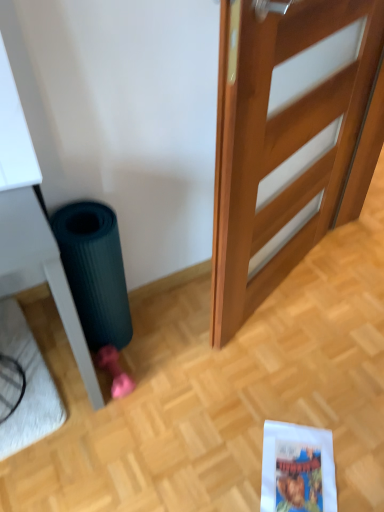
Question: Are wooden door at center and dark green rubber mat at lower left beside each other?

Choices:
 (A) no
 (B) yes

Answer: (A)

Question: Does wooden door at center appear on the right side of dark green rubber mat at lower left?

Choices:
 (A) yes
 (B) no

Answer: (A)

Question: From a real-world perspective, is wooden door at center physically below dark green rubber mat at lower left?

Choices:
 (A) no
 (B) yes

Answer: (A)

Question: From the image's perspective, would you say wooden door at center is positioned over dark green rubber mat at lower left?

Choices:
 (A) no
 (B) yes

Answer: (B)

Question: Does wooden door at center have a larger size compared to dark green rubber mat at lower left?

Choices:
 (A) no
 (B) yes

Answer: (B)

Question: Is white plush doormat at lower left spatially inside wooden door at center, or outside of it?

Choices:
 (A) outside
 (B) inside

Answer: (A)

Question: Looking at their shapes, would you say white plush doormat at lower left is wider or thinner than wooden door at center?

Choices:
 (A) wide
 (B) thin

Answer: (A)

Question: Based on their sizes in the image, would you say white plush doormat at lower left is bigger or smaller than wooden door at center?

Choices:
 (A) small
 (B) big

Answer: (A)

Question: Would you say white plush doormat at lower left is to the left or to the right of wooden door at center in the picture?

Choices:
 (A) right
 (B) left

Answer: (B)

Question: Is point (66, 273) closer or farther from the camera than point (44, 403)?

Choices:
 (A) closer
 (B) farther

Answer: (A)

Question: In the image, is dark green rubber mat at lower left positioned in front of or behind white plush doormat at lower left?

Choices:
 (A) behind
 (B) front

Answer: (B)

Question: Looking at the image, does dark green rubber mat at lower left seem bigger or smaller compared to white plush doormat at lower left?

Choices:
 (A) small
 (B) big

Answer: (B)

Question: From a real-world perspective, is dark green rubber mat at lower left positioned above or below white plush doormat at lower left?

Choices:
 (A) below
 (B) above

Answer: (B)

Question: Considering the positions of point (311, 506) and point (74, 236), is point (311, 506) closer or farther from the camera than point (74, 236)?

Choices:
 (A) closer
 (B) farther

Answer: (A)

Question: Is blue glossy comic book at lower right taller or shorter than dark green rubber mat at lower left?

Choices:
 (A) tall
 (B) short

Answer: (B)